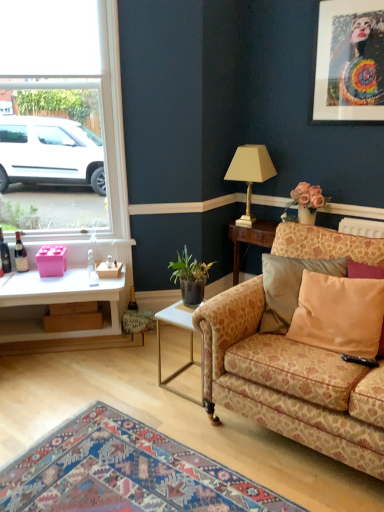
Identify the location of free space in front of pink matte plastic box at left, which is the first box in top-to-bottom order. (41, 283).